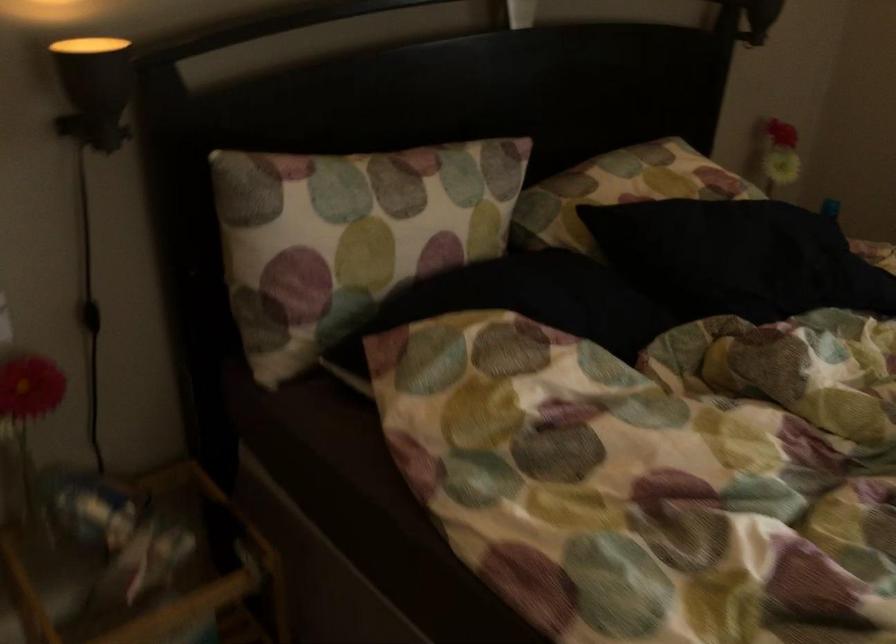
Describe the element at coordinates (90, 316) in the screenshot. I see `a black cord switch` at that location.